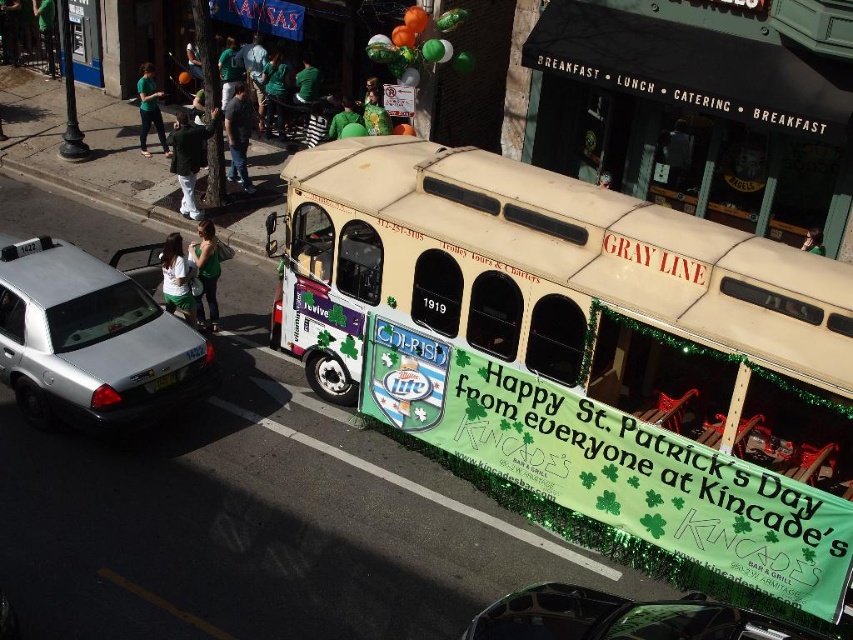
Is green fabric shirt at lower left wider than green fabric sign at center?

No, green fabric shirt at lower left is not wider than green fabric sign at center.

Between green fabric shirt at lower left and green fabric sign at center, which one has less height?

Standing shorter between the two is green fabric shirt at lower left.

Is point (177, 284) positioned after point (384, 113)?

No, it is not.

The image size is (853, 640). I want to click on green fabric shirt at lower left, so click(x=177, y=278).

Does denim jeans at center have a greater height compared to green matte shirt at center?

Correct, denim jeans at center is much taller as green matte shirt at center.

Which is in front, point (234, 90) or point (331, 140)?

Positioned in front is point (234, 90).

Does point (236, 92) lie behind point (344, 112)?

No, (236, 92) is in front of (344, 112).

The image size is (853, 640). I want to click on denim jeans at center, so click(x=238, y=132).

Which is more to the left, green fabric bag at lower left or green fabric shirt at lower left?

From the viewer's perspective, green fabric shirt at lower left appears more on the left side.

Does green fabric bag at lower left have a greater width compared to green fabric shirt at lower left?

A: No, green fabric bag at lower left is not wider than green fabric shirt at lower left.

Describe the element at coordinates (206, 273) in the screenshot. I see `green fabric bag at lower left` at that location.

Identify the location of green fabric bag at lower left. The height and width of the screenshot is (640, 853). (206, 273).